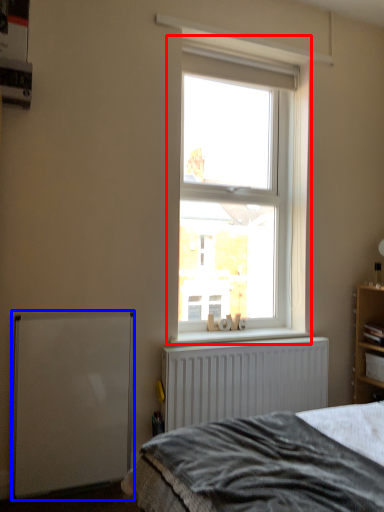
Question: Which object is further to the camera taking this photo, window (highlighted by a red box) or wide (highlighted by a blue box)?

Choices:
 (A) window
 (B) wide

Answer: (A)